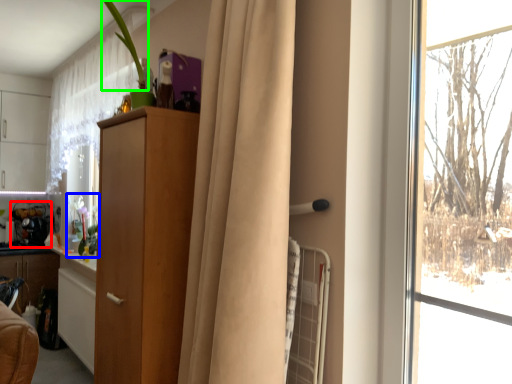
Question: Which object is the farthest from appliance (highlighted by a red box)? Choose among these: floral arrangement (highlighted by a blue box) or plant (highlighted by a green box).

Choices:
 (A) floral arrangement
 (B) plant

Answer: (B)